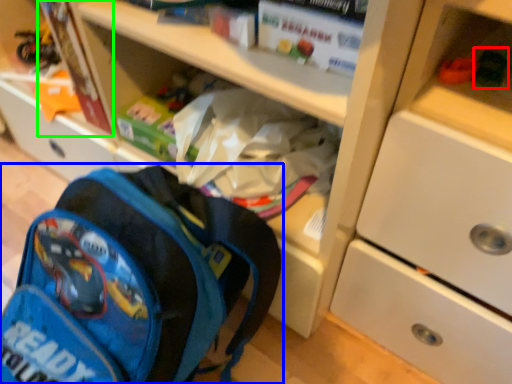
Question: Based on their relative distances, which object is farther from toy (highlighted by a red box)? Choose from backpack (highlighted by a blue box) and paperback book (highlighted by a green box).

Choices:
 (A) backpack
 (B) paperback book

Answer: (B)